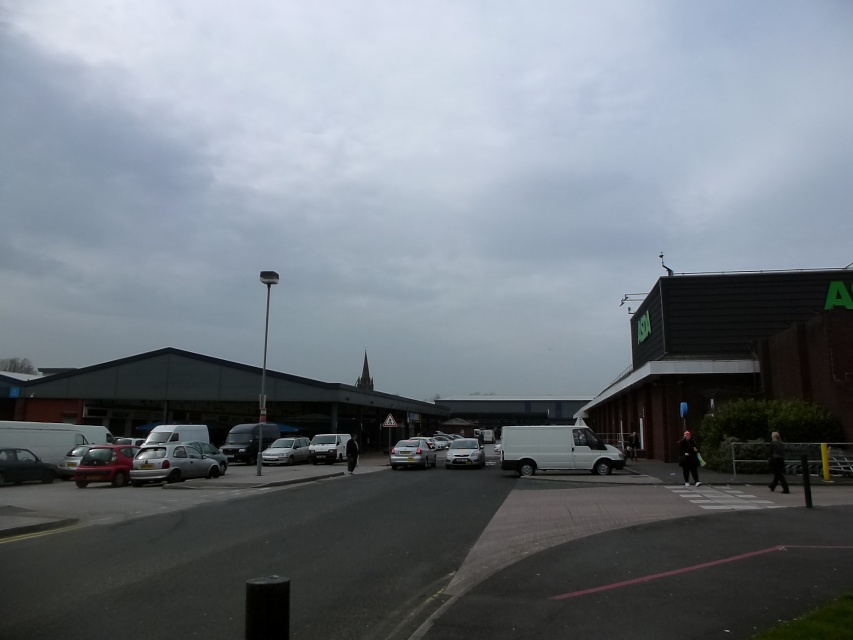
Question: Which object is positioned closest to the shiny black car at lower left?

Choices:
 (A) metallic silver cars at center
 (B) silver metallic car at center
 (C) satin silver van at center
 (D) silver metallic hatchback at center

Answer: (C)

Question: Does silver metallic hatchback at center-left appear on the right side of shiny black car at lower left?

Choices:
 (A) no
 (B) yes

Answer: (B)

Question: Can you confirm if silver metallic car at center is positioned to the right of silver metallic hatchback at lower left?

Choices:
 (A) no
 (B) yes

Answer: (B)

Question: Which point is farther to the camera?

Choices:
 (A) (200, 444)
 (B) (32, 464)
 (C) (91, 472)
 (D) (289, 440)

Answer: (D)

Question: Which point appears farthest from the camera in this image?

Choices:
 (A) (457, 438)
 (B) (204, 444)
 (C) (125, 480)
 (D) (299, 458)

Answer: (A)

Question: Can you confirm if metallic silver cars at center is positioned to the left of silver metallic hatchback at center?

Choices:
 (A) no
 (B) yes

Answer: (A)